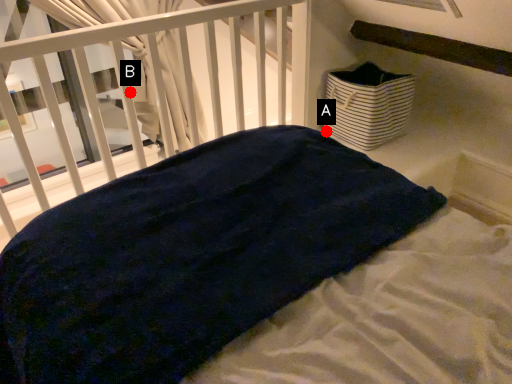
Question: Two points are circled on the image, labeled by A and B beside each circle. Which point is farther from the camera taking this photo?

Choices:
 (A) A is further
 (B) B is further

Answer: (A)